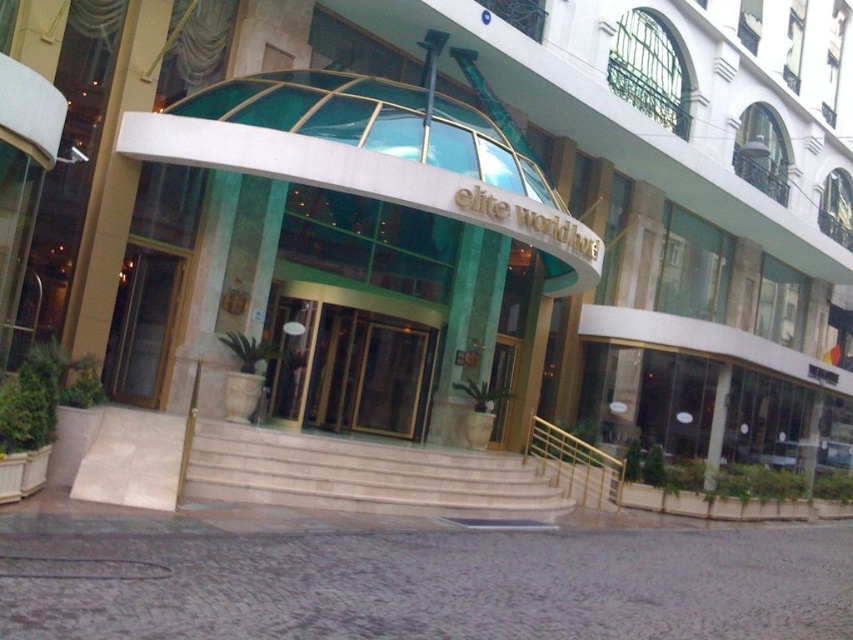
Question: Is gold/glass door at center below matte glass door at left?

Choices:
 (A) yes
 (B) no

Answer: (A)

Question: Can you confirm if gold/glass door at center is thinner than matte glass door at left?

Choices:
 (A) no
 (B) yes

Answer: (A)

Question: Which point is closer to the camera?

Choices:
 (A) gold/glass door at center
 (B) matte glass door at left

Answer: (B)

Question: Which point is farther to the camera?

Choices:
 (A) matte glass door at left
 (B) gold/glass door at center

Answer: (B)

Question: Which object appears farthest from the camera in this image?

Choices:
 (A) gold/glass door at center
 (B) matte glass door at left

Answer: (A)

Question: Is gold/glass door at center to the right of matte glass door at left from the viewer's perspective?

Choices:
 (A) yes
 (B) no

Answer: (A)